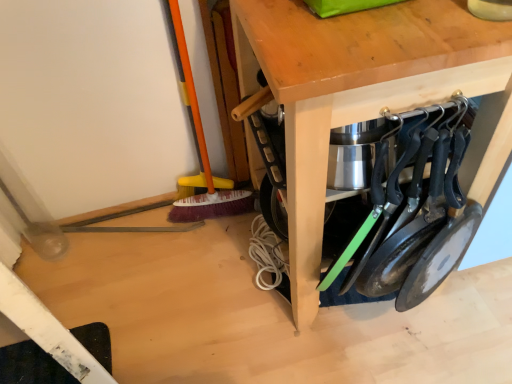
Locate an element on the screen. The height and width of the screenshot is (384, 512). free location to the left of wooden table at center is located at coordinates (184, 280).